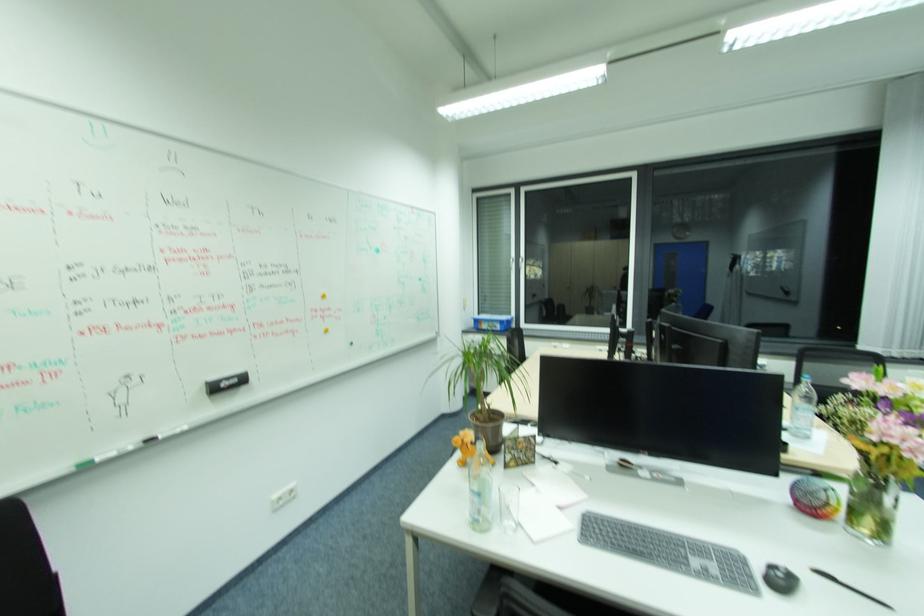
Find where to lift the plastic water bottle. Please return your answer as a coordinate pair (x, y).

(480, 488)